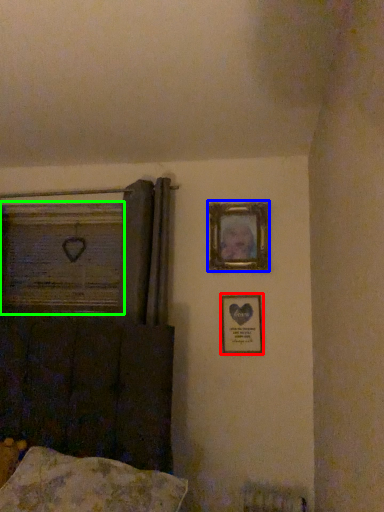
Question: Which is farther away from picture frame (highlighted by a red box)? picture frame (highlighted by a blue box) or window frame (highlighted by a green box)?

Choices:
 (A) picture frame
 (B) window frame

Answer: (B)